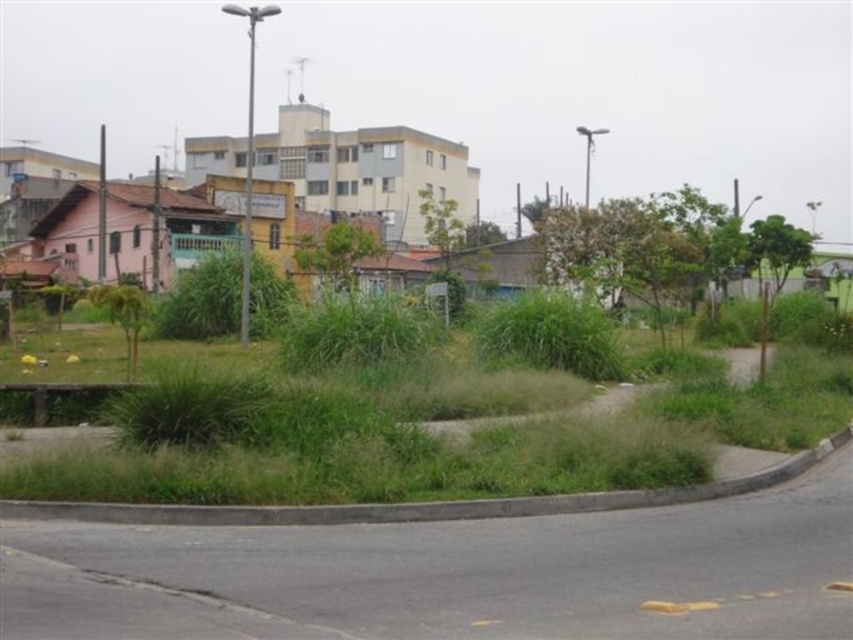
Question: Is green grass at lower center smaller than green grassy weed at lower left?

Choices:
 (A) yes
 (B) no

Answer: (A)

Question: Is green grass at lower center to the right of green grassy weed at lower left from the viewer's perspective?

Choices:
 (A) yes
 (B) no

Answer: (A)

Question: Is the position of green grass at lower center more distant than that of green grassy weed at lower left?

Choices:
 (A) yes
 (B) no

Answer: (B)

Question: Which point is farther from the camera taking this photo?

Choices:
 (A) click(x=695, y=397)
 (B) click(x=125, y=346)

Answer: (B)